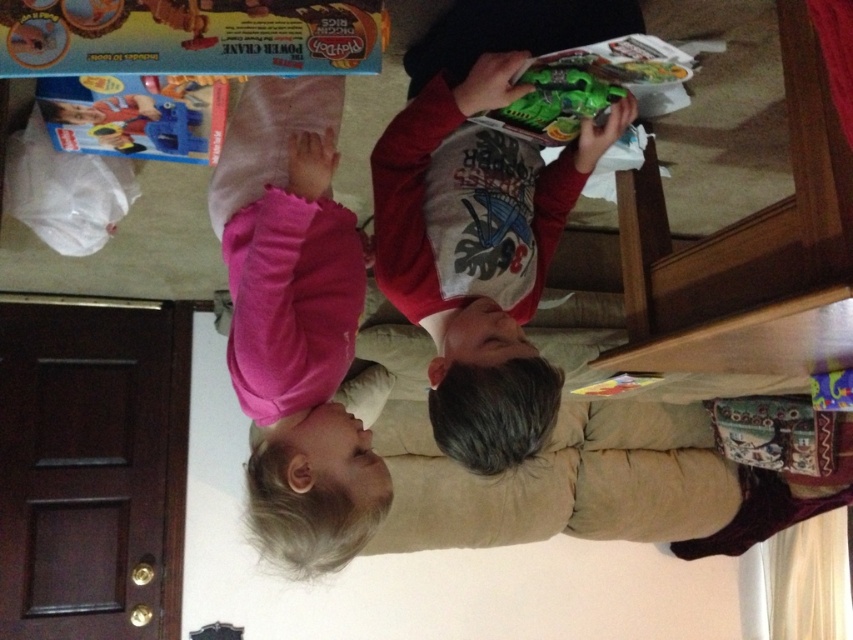
Question: Which of the following is the closest to the observer?

Choices:
 (A) (326, 224)
 (B) (543, 88)

Answer: (A)

Question: Does pink soft fabric at lower left have a smaller size compared to matte red shirt at center?

Choices:
 (A) no
 (B) yes

Answer: (A)

Question: Does matte red shirt at center appear under green matte toy gun at upper center?

Choices:
 (A) yes
 (B) no

Answer: (A)

Question: Estimate the real-world distances between objects in this image. Which object is farther from the matte red shirt at center?

Choices:
 (A) green matte toy gun at upper center
 (B) pink soft fabric at lower left

Answer: (B)

Question: In this image, where is pink soft fabric at lower left located relative to matte red shirt at center?

Choices:
 (A) above
 (B) below

Answer: (B)

Question: Estimate the real-world distances between objects in this image. Which object is closer to the pink soft fabric at lower left?

Choices:
 (A) green matte toy gun at upper center
 (B) matte red shirt at center

Answer: (B)